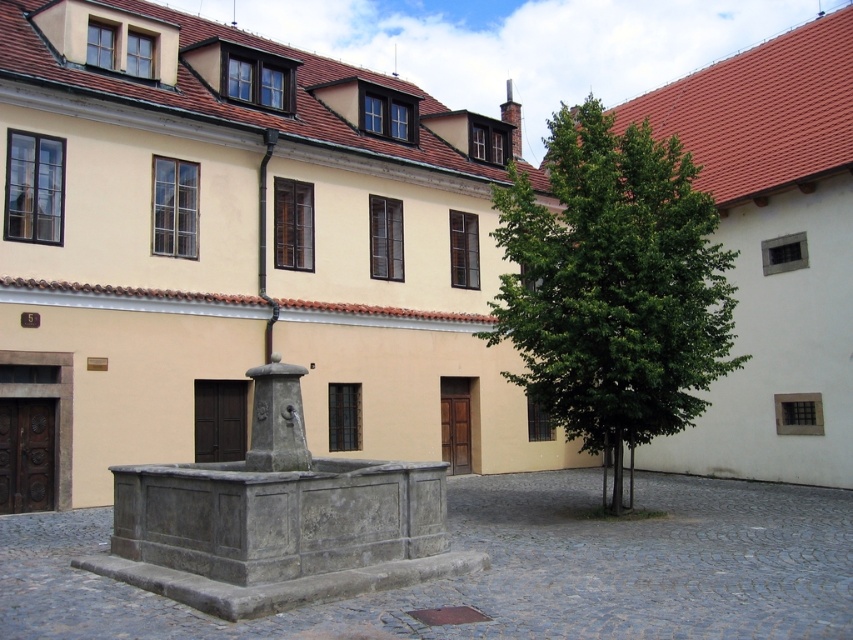
Is point (728, 333) positioned in front of point (279, 433)?

No, (728, 333) is behind (279, 433).

Between point (525, 323) and point (248, 467), which one is positioned behind?

Point (525, 323)

Does point (706, 298) come closer to viewer compared to point (271, 378)?

That is False.

Locate an element on the screen. green leafy tree at center is located at coordinates (613, 285).